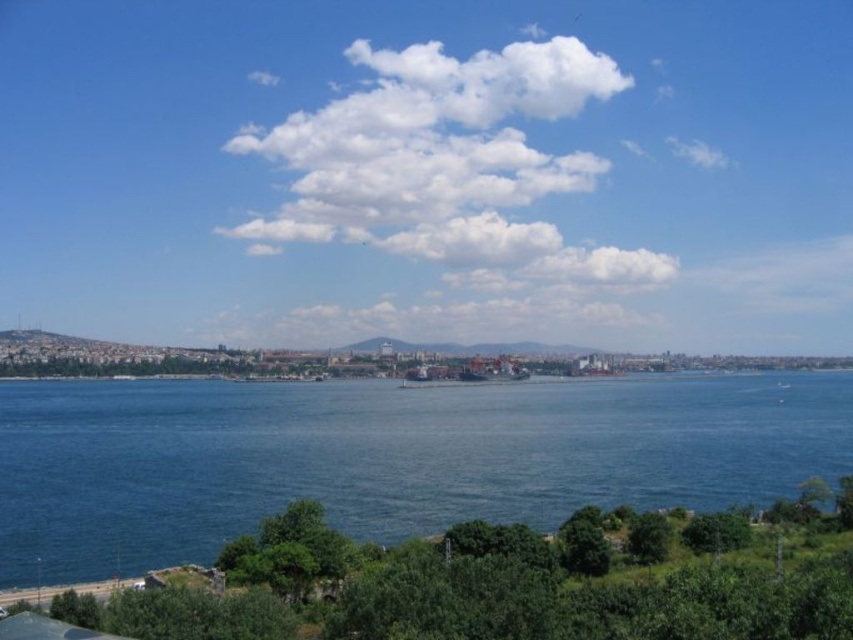
You are standing at the edge of the coastal landscape and see the blue liquid water at lower center and the white fluffy cloud at upper center. Which object is positioned to the left of the other?

The blue liquid water at lower center is positioned to the left of the white fluffy cloud at upper center.

From the picture: You are standing at the edge of the coastal landscape looking out towards the water. There are two points marked in the scene, one at coordinates point (581, 424) and the other at point (537, 156). Which of these two points is closer to you?

Point (581, 424) is closer to the viewer than point (537, 156).

You are an aerial photographer capturing the coastal landscape. You notice the blue liquid water at lower center and the white fluffy cloud at upper center. Which of these two elements takes up more visual space in your photo?

The white fluffy cloud at upper center occupies more visual space than the blue liquid water at lower center.